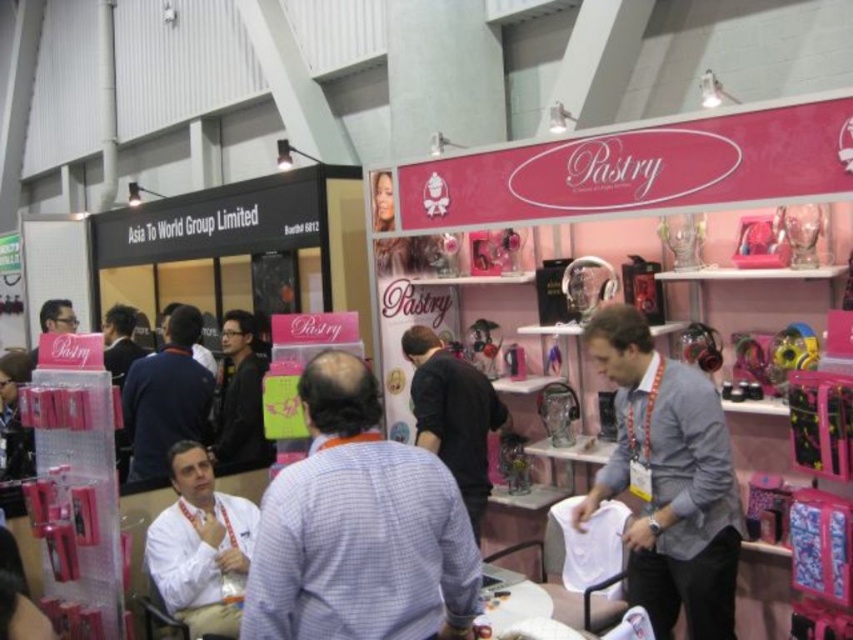
Can you confirm if matte black jacket at center is wider than matte black shirt at center?

Yes, matte black jacket at center is wider than matte black shirt at center.

Does matte black jacket at center appear over matte black shirt at center?

No, matte black jacket at center is not above matte black shirt at center.

What do you see at coordinates (239, 400) in the screenshot? I see `matte black jacket at center` at bounding box center [239, 400].

Identify the location of matte black jacket at center. (239, 400).

Does gray fabric shirt at center have a lesser width compared to matte black laptop at left?

→ No, gray fabric shirt at center is not thinner than matte black laptop at left.

Does gray fabric shirt at center have a greater width compared to matte black laptop at left?

Indeed, gray fabric shirt at center has a greater width compared to matte black laptop at left.

Where is `gray fabric shirt at center`? Image resolution: width=853 pixels, height=640 pixels. gray fabric shirt at center is located at coordinates (668, 480).

Can you confirm if gray fabric shirt at center is wider than black matte shirt at center?

Indeed, gray fabric shirt at center has a greater width compared to black matte shirt at center.

Can you confirm if gray fabric shirt at center is smaller than black matte shirt at center?

Actually, gray fabric shirt at center might be larger than black matte shirt at center.

Does point (717, 579) come behind point (440, 445)?

No, (717, 579) is in front of (440, 445).

The height and width of the screenshot is (640, 853). Identify the location of gray fabric shirt at center. (668, 480).